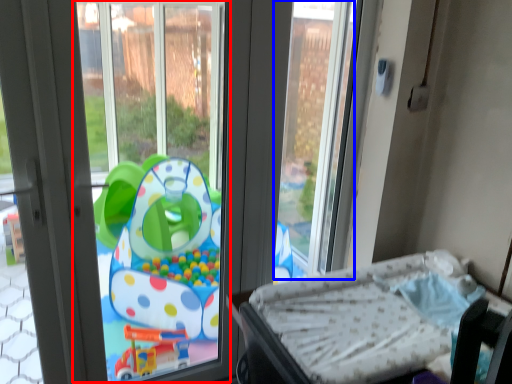
Question: Which object appears closest to the camera in this image, window screen (highlighted by a red box) or window screen (highlighted by a blue box)?

Choices:
 (A) window screen
 (B) window screen

Answer: (A)